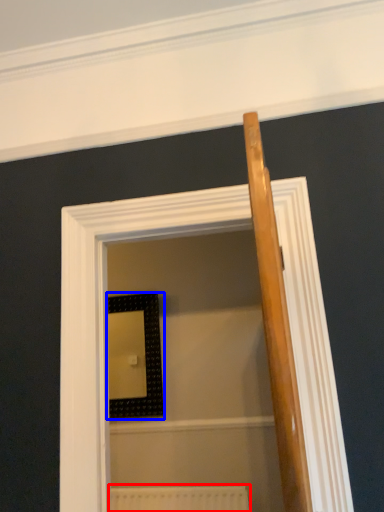
Question: Which object appears farthest to the camera in this image, radiator (highlighted by a red box) or picture frame (highlighted by a blue box)?

Choices:
 (A) radiator
 (B) picture frame

Answer: (B)